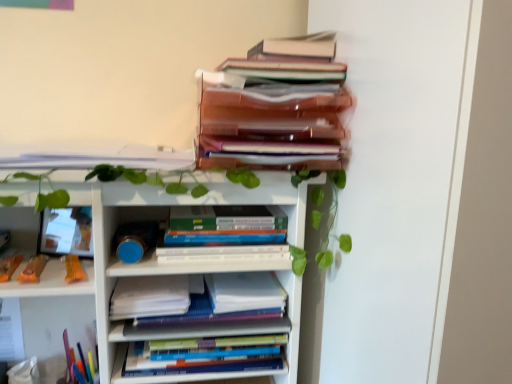
The height and width of the screenshot is (384, 512). What are the coordinates of `blank space situated above white paper at center, the first paperback book viewed from the left (from a real-world perspective)` in the screenshot? It's located at (155, 286).